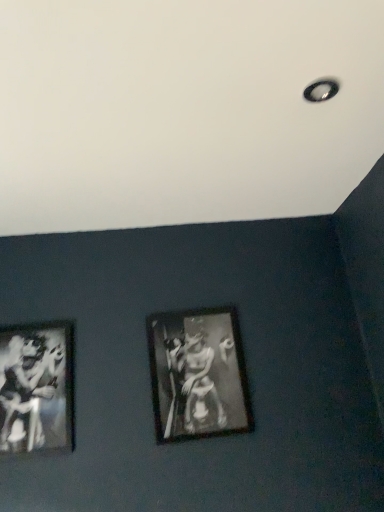
What is the approximate width of black glossy print at left?

black glossy print at left is 0.99 inches wide.

Identify the location of black glossy print at left. (31, 392).

Based on the photo, measure the distance between point (23, 404) and camera.

A distance of 1.45 meters exists between point (23, 404) and camera.

What is the approximate height of black glossy print at left?

It is 17.23 inches.

Describe the element at coordinates (31, 392) in the screenshot. I see `black glossy print at left` at that location.

The width and height of the screenshot is (384, 512). I want to click on black matte picture frame at center, so click(x=198, y=374).

Describe the element at coordinates (198, 374) in the screenshot. This screenshot has height=512, width=384. I see `black matte picture frame at center` at that location.

In order to face black matte picture frame at center, should I rotate leftwards or rightwards?

A 0.722 degree turn to the right will do.

The height and width of the screenshot is (512, 384). Find the location of `black glossy print at left`. black glossy print at left is located at coordinates (31, 392).

Does black matte picture frame at center appear on the right side of black glossy print at left?

Correct, you'll find black matte picture frame at center to the right of black glossy print at left.

Between black matte picture frame at center and black glossy print at left, which one is positioned behind?

black matte picture frame at center.

Is point (214, 400) closer or farther from the camera than point (39, 409)?

Point (214, 400) is positioned farther from the camera compared to point (39, 409).

From the image's perspective, which is below, black matte picture frame at center or black glossy print at left?

black glossy print at left.

Looking at this image, from a real-world perspective, is black matte picture frame at center positioned above or below black glossy print at left?

In terms of real-world spatial position, black matte picture frame at center is below black glossy print at left.

Based on the photo, which object is thinner, black matte picture frame at center or black glossy print at left?

With smaller width is black glossy print at left.

Does black matte picture frame at center have a lesser height compared to black glossy print at left?

No, black matte picture frame at center is not shorter than black glossy print at left.

Considering the relative sizes of black matte picture frame at center and black glossy print at left in the image provided, is black matte picture frame at center bigger than black glossy print at left?

Indeed, black matte picture frame at center has a larger size compared to black glossy print at left.

Is black matte picture frame at center completely or partially outside of black glossy print at left?

Absolutely, black matte picture frame at center is external to black glossy print at left.

Would you say black matte picture frame at center is a long distance from black glossy print at left?

Actually, black matte picture frame at center and black glossy print at left are a little close together.

Could you tell me if black matte picture frame at center is turned towards black glossy print at left?

No, black matte picture frame at center is not turned towards black glossy print at left.

In order to click on picture frame that is above the black glossy print at left (from the image's perspective) in this screenshot , I will do [198, 374].

Which is more to the left, black glossy print at left or black matte picture frame at center?

black glossy print at left.

Considering their positions, is black glossy print at left located in front of or behind black matte picture frame at center?

In the image, black glossy print at left appears in front of black matte picture frame at center.

Does point (36, 416) come farther from viewer compared to point (208, 407)?

No, (36, 416) is in front of (208, 407).

From the image's perspective, which is below, black glossy print at left or black matte picture frame at center?

black glossy print at left, from the image's perspective.

From a real-world perspective, is black glossy print at left positioned under black matte picture frame at center based on gravity?

No, from a real-world perspective, black glossy print at left is not under black matte picture frame at center.

Looking at their sizes, would you say black glossy print at left is wider or thinner than black matte picture frame at center?

Considering their sizes, black glossy print at left looks slimmer than black matte picture frame at center.

Is black glossy print at left taller than black matte picture frame at center?

In fact, black glossy print at left may be shorter than black matte picture frame at center.

Looking at the image, does black glossy print at left seem bigger or smaller compared to black matte picture frame at center?

Clearly, black glossy print at left is smaller in size than black matte picture frame at center.

Is black matte picture frame at center inside black glossy print at left?

That's incorrect, black matte picture frame at center is not inside black glossy print at left.

Is black glossy print at left far from black matte picture frame at center?

No.

Is black matte picture frame at center at the back of black glossy print at left?

No.

The height and width of the screenshot is (512, 384). Find the location of `person in front of the black matte picture frame at center`. person in front of the black matte picture frame at center is located at coordinates (31, 392).

The height and width of the screenshot is (512, 384). I want to click on person located on the left of black matte picture frame at center, so click(x=31, y=392).

Locate an element on the screen. Image resolution: width=384 pixels, height=512 pixels. picture frame behind the black glossy print at left is located at coordinates (198, 374).